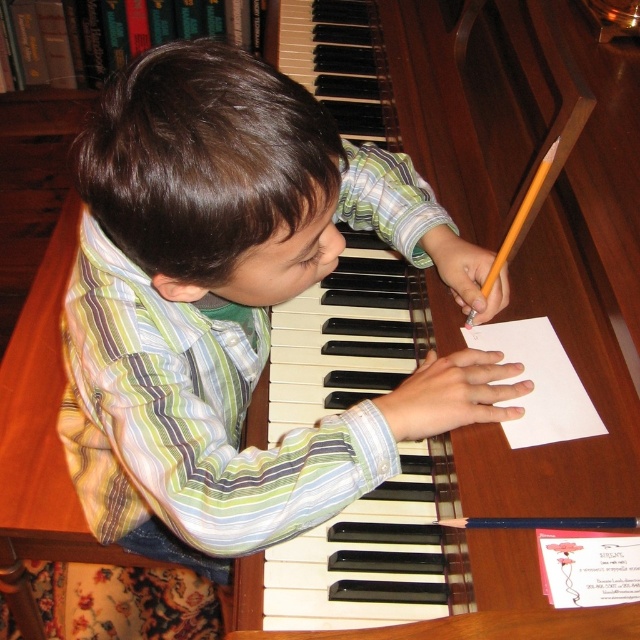
You are observing a boy at a piano. The striped cotton shirt at center and wooden piano keys at center are both visible. Which object is shorter in height?

The striped cotton shirt at center is shorter in height compared to the wooden piano keys at center.